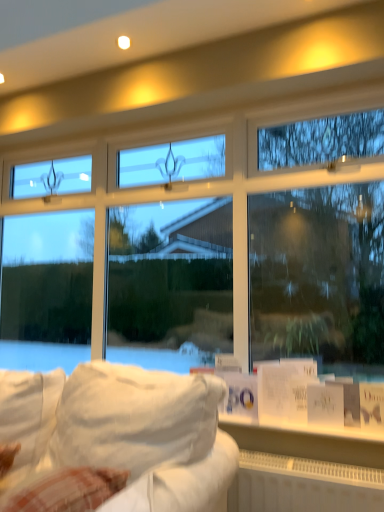
Question: From the image's perspective, is white fabric couch at lower left above or below white plastic radiator at lower center?

Choices:
 (A) below
 (B) above

Answer: (B)

Question: Is point (165, 432) positioned closer to the camera than point (306, 468)?

Choices:
 (A) farther
 (B) closer

Answer: (B)

Question: Choose the correct answer: Is white fabric couch at lower left inside white plastic radiator at lower center or outside it?

Choices:
 (A) outside
 (B) inside

Answer: (A)

Question: Is white plastic radiator at lower center wider or thinner than white fabric couch at lower left?

Choices:
 (A) thin
 (B) wide

Answer: (A)

Question: Considering the positions of white plastic radiator at lower center and white fabric couch at lower left in the image, is white plastic radiator at lower center bigger or smaller than white fabric couch at lower left?

Choices:
 (A) big
 (B) small

Answer: (B)

Question: From a real-world perspective, is white plastic radiator at lower center physically located above or below white fabric couch at lower left?

Choices:
 (A) below
 (B) above

Answer: (A)

Question: Which is correct: white plastic radiator at lower center is inside white fabric couch at lower left, or outside of it?

Choices:
 (A) outside
 (B) inside

Answer: (A)